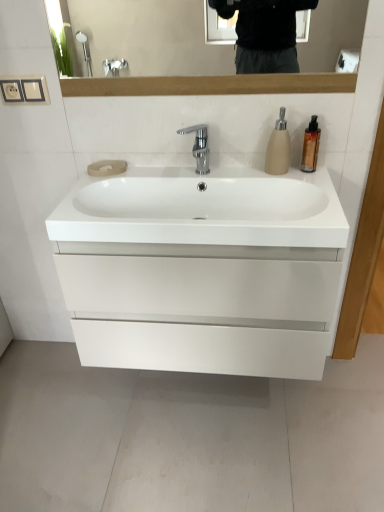
Question: Based on their positions, is matte beige soap dispenser at upper right, arranged as the second soap dispenser when viewed from the right, located to the left or right of gold metallic soap dispenser at upper right, which is the first soap dispenser from right to left?

Choices:
 (A) left
 (B) right

Answer: (A)

Question: Considering the positions of matte beige soap dispenser at upper right, which ranks as the 1th soap dispenser in left-to-right order, and gold metallic soap dispenser at upper right, which is the first soap dispenser from right to left, in the image, is matte beige soap dispenser at upper right, which ranks as the 1th soap dispenser in left-to-right order, bigger or smaller than gold metallic soap dispenser at upper right, which is the first soap dispenser from right to left,?

Choices:
 (A) big
 (B) small

Answer: (A)

Question: Estimate the real-world distances between objects in this image. Which object is farther from the polished chrome faucet at center?

Choices:
 (A) white glossy sink at center
 (B) matte beige soap dispenser at upper right, arranged as the second soap dispenser when viewed from the right
 (C) white glossy cabinet at center
 (D) gold metallic soap dispenser at upper right, which is the first soap dispenser from right to left

Answer: (C)

Question: Which object is the farthest from the polished chrome faucet at center?

Choices:
 (A) white glossy sink at center
 (B) gold metallic soap dispenser at upper right, which is the first soap dispenser from right to left
 (C) matte beige soap dispenser at upper right, arranged as the second soap dispenser when viewed from the right
 (D) white glossy cabinet at center

Answer: (D)